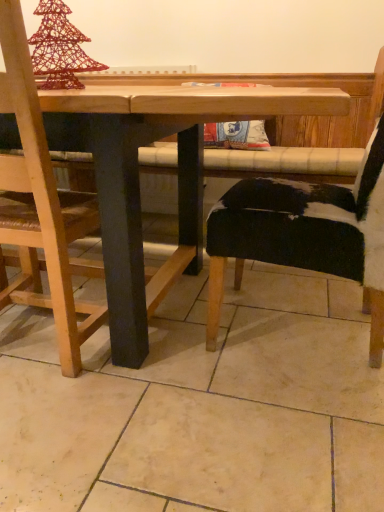
Question: From a real-world perspective, is wooden chair at left, the 2th chair viewed from the right, located higher than wooden table at center?

Choices:
 (A) yes
 (B) no

Answer: (A)

Question: Is wooden chair at left, the 2th chair viewed from the right, looking in the opposite direction of wooden table at center?

Choices:
 (A) yes
 (B) no

Answer: (A)

Question: From the image's perspective, is wooden chair at left, the 2th chair viewed from the right, located above wooden table at center?

Choices:
 (A) no
 (B) yes

Answer: (B)

Question: Is wooden chair at left, which is the first chair in left-to-right order, taller than wooden table at center?

Choices:
 (A) no
 (B) yes

Answer: (B)

Question: Does wooden chair at left, which is the first chair in left-to-right order, come behind wooden table at center?

Choices:
 (A) yes
 (B) no

Answer: (A)

Question: Is wooden chair at left, which is the first chair in left-to-right order, located outside wooden table at center?

Choices:
 (A) no
 (B) yes

Answer: (A)

Question: From the image's perspective, would you say black cowhide chair at right, the second chair in the left-to-right sequence, is positioned over wooden chair at left, which is the first chair in left-to-right order?

Choices:
 (A) no
 (B) yes

Answer: (B)

Question: Is black cowhide chair at right, which is counted as the first chair, starting from the right, in contact with wooden chair at left, which is the first chair in left-to-right order?

Choices:
 (A) no
 (B) yes

Answer: (A)

Question: Considering the relative sizes of black cowhide chair at right, which is counted as the first chair, starting from the right, and wooden chair at left, the 2th chair viewed from the right, in the image provided, is black cowhide chair at right, which is counted as the first chair, starting from the right, thinner than wooden chair at left, the 2th chair viewed from the right,?

Choices:
 (A) no
 (B) yes

Answer: (A)

Question: Could you tell me if black cowhide chair at right, which is counted as the first chair, starting from the right, is facing wooden chair at left, the 2th chair viewed from the right?

Choices:
 (A) yes
 (B) no

Answer: (A)

Question: From the image's perspective, is black cowhide chair at right, which is counted as the first chair, starting from the right, below wooden chair at left, which is the first chair in left-to-right order?

Choices:
 (A) no
 (B) yes

Answer: (A)

Question: Is wooden chair at left, which is the first chair in left-to-right order, completely or partially inside black cowhide chair at right, which is counted as the first chair, starting from the right?

Choices:
 (A) yes
 (B) no

Answer: (B)

Question: Would you consider wooden table at center to be distant from wooden chair at left, the 2th chair viewed from the right?

Choices:
 (A) yes
 (B) no

Answer: (B)